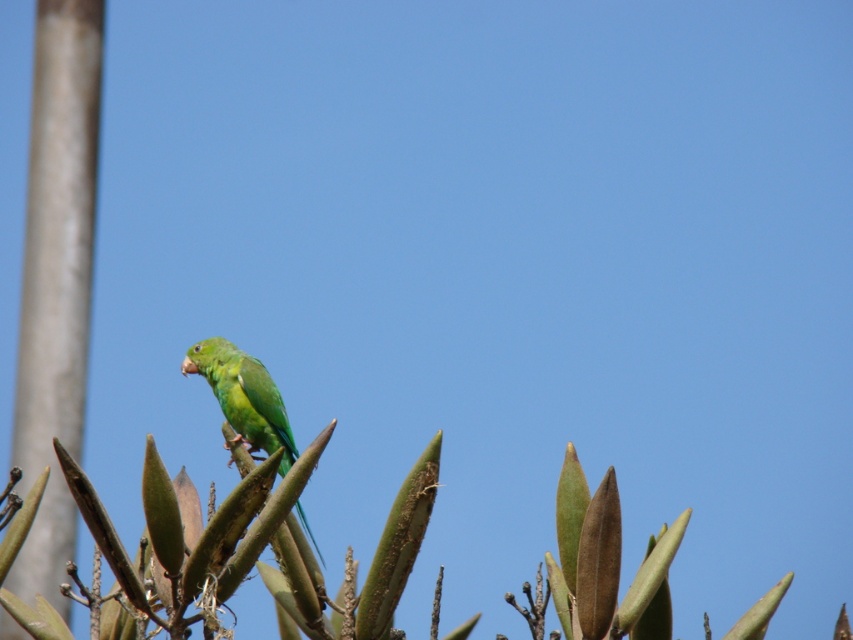
Is smooth gray pole at left below green matte parrot at center?

Incorrect, smooth gray pole at left is not positioned below green matte parrot at center.

Does smooth gray pole at left have a greater width compared to green matte parrot at center?

No, smooth gray pole at left is not wider than green matte parrot at center.

Find the location of a particular element. smooth gray pole at left is located at coordinates (56, 278).